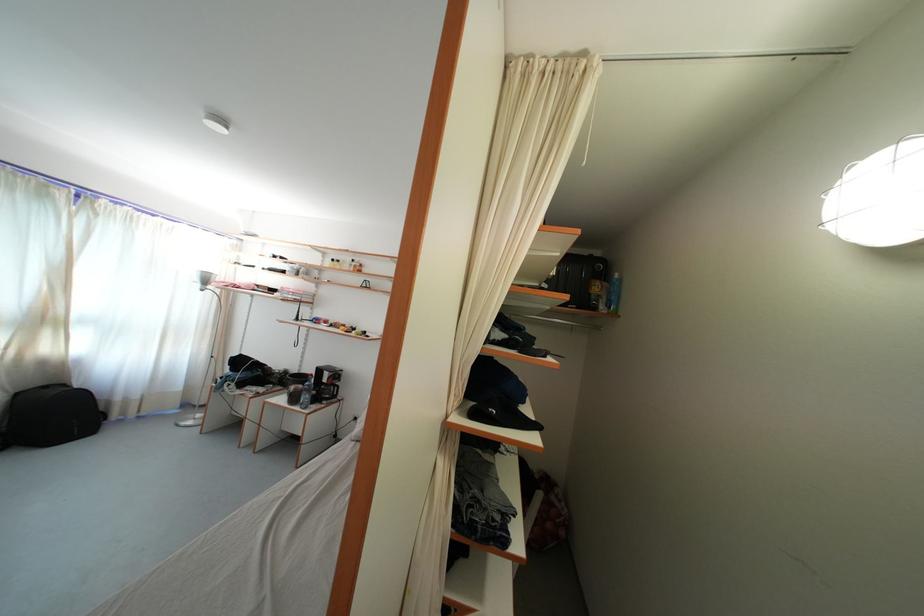
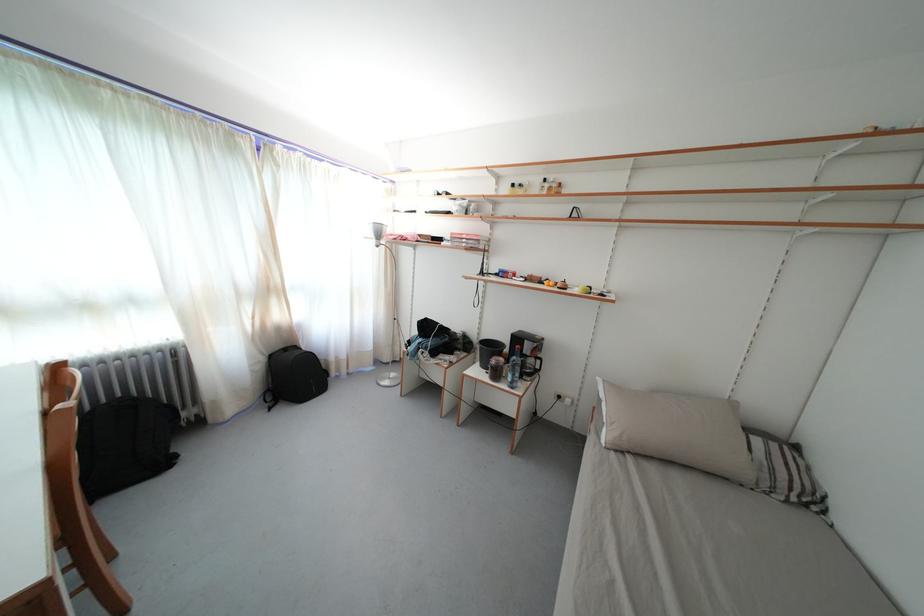
Where in the second image is the point corresponding to (203,286) from the first image?

(378, 241)